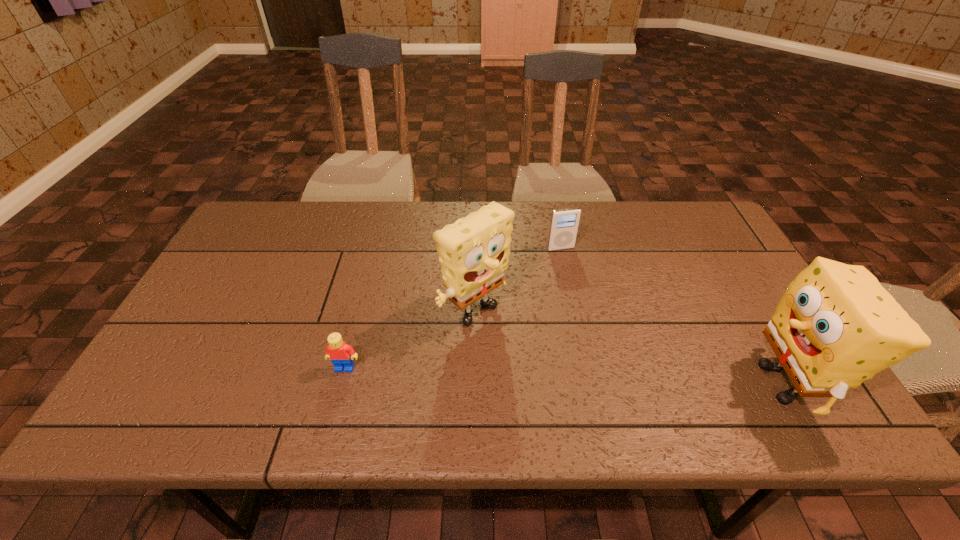
In order to click on blank space at the far edge of the desktop in this screenshot , I will do `click(537, 207)`.

The image size is (960, 540). In the image, there is a desktop. What are the coordinates of `vacant space at the near edge` in the screenshot? It's located at (211, 392).

This screenshot has width=960, height=540. I want to click on vacant region at the left edge of the desktop, so click(219, 262).

The height and width of the screenshot is (540, 960). In the image, there is a desktop. In order to click on vacant area at the right edge in this screenshot , I will do `click(716, 277)`.

At what (x,y) coordinates should I click in order to perform the action: click on free point at the far left corner. Please return your answer as a coordinate pair (x, y). Looking at the image, I should click on (264, 216).

Identify the location of free space at the far right corner of the desktop. The image size is (960, 540). (710, 223).

I want to click on free spot between the right sponge and the second object from right to left, so click(x=672, y=315).

The height and width of the screenshot is (540, 960). I want to click on free space between the right sponge and the leftmost object, so coord(564,375).

This screenshot has height=540, width=960. I want to click on free space between the farthest object and the rightmost object, so click(x=672, y=315).

The height and width of the screenshot is (540, 960). Find the location of `empty space between the right sponge and the third object from right to left`. empty space between the right sponge and the third object from right to left is located at coordinates (630, 350).